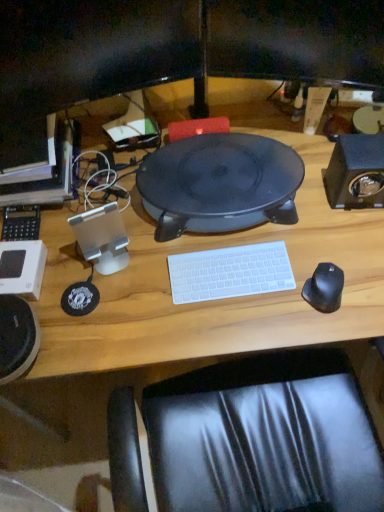
Where is `vacant space that is in between black matte speaker at right and white plastic keyboard at center`? This screenshot has width=384, height=512. vacant space that is in between black matte speaker at right and white plastic keyboard at center is located at coordinates pyautogui.click(x=293, y=231).